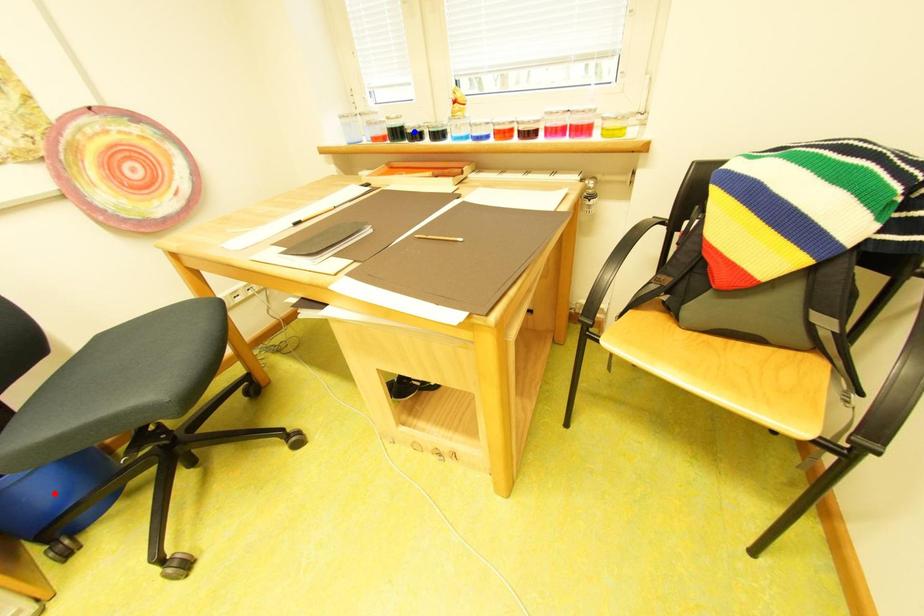
Question: Two points are marked on the image. Which point is closer to the camera?

Choices:
 (A) Blue point is closer.
 (B) Red point is closer.

Answer: (B)